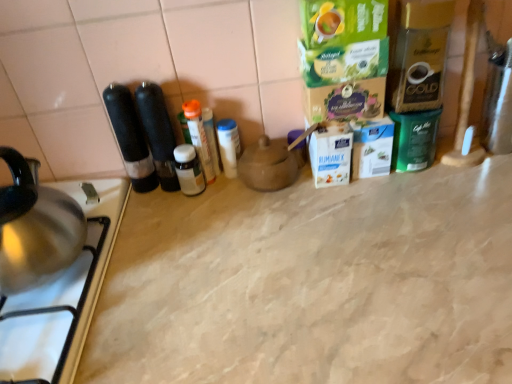
Find the location of a particular element. This screenshot has height=384, width=512. vacant area that lies to the right of white glossy bottle at center, which is the third bottle from right to left is located at coordinates (273, 207).